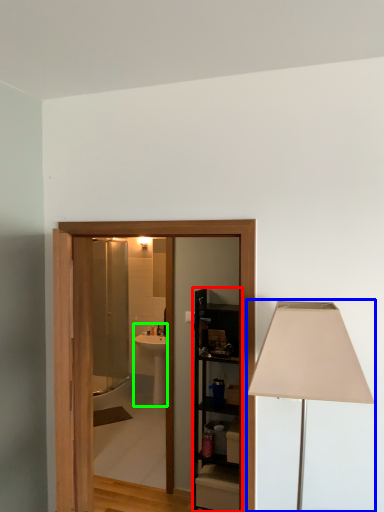
Question: Which object is the farthest from cabinetry (highlighted by a red box)? Choose among these: lamp (highlighted by a blue box) or sink (highlighted by a green box).

Choices:
 (A) lamp
 (B) sink

Answer: (A)